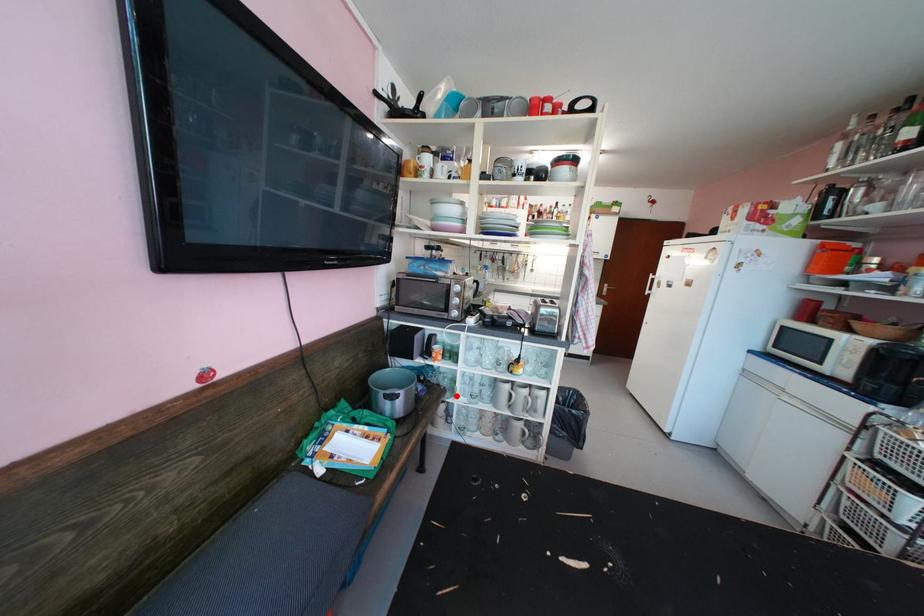
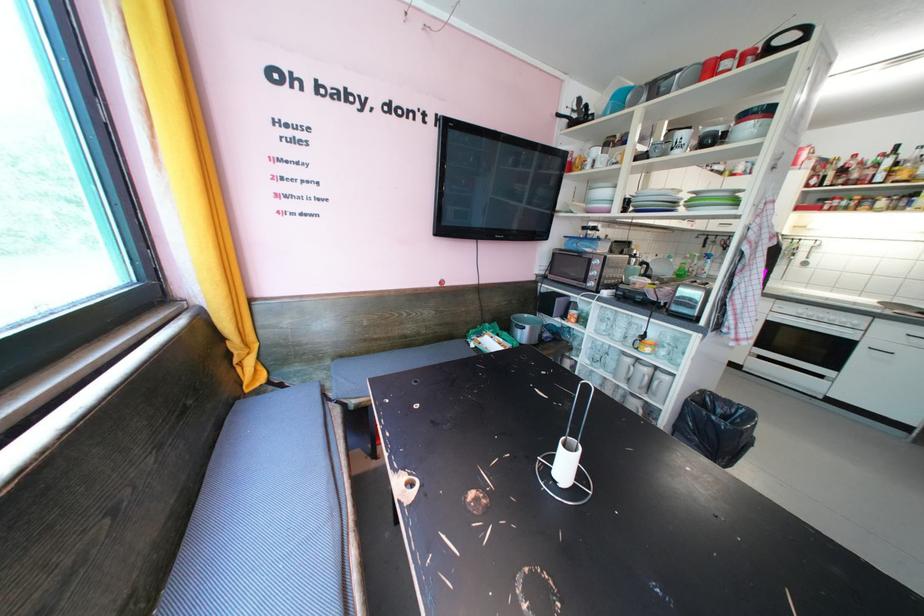
Find the pixel in the second image that matches the highlighted location in the first image.

(582, 354)